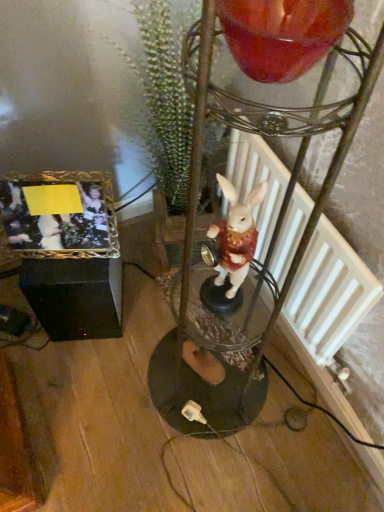
Question: Is white porcelain rabbit at center taller or shorter than green textured plant at center?

Choices:
 (A) short
 (B) tall

Answer: (A)

Question: Would you say white porcelain rabbit at center is to the left or to the right of green textured plant at center in the picture?

Choices:
 (A) left
 (B) right

Answer: (B)

Question: Which object is positioned closest to the green textured plant at center?

Choices:
 (A) white matte radiator at center-right
 (B) gold metallic photo frame at lower left
 (C) white porcelain rabbit at center
 (D) shiny glass candle at upper center

Answer: (A)

Question: Which of these objects is positioned farthest from the white porcelain rabbit at center?

Choices:
 (A) green textured plant at center
 (B) white matte radiator at center-right
 (C) shiny glass candle at upper center
 (D) gold metallic photo frame at lower left

Answer: (C)